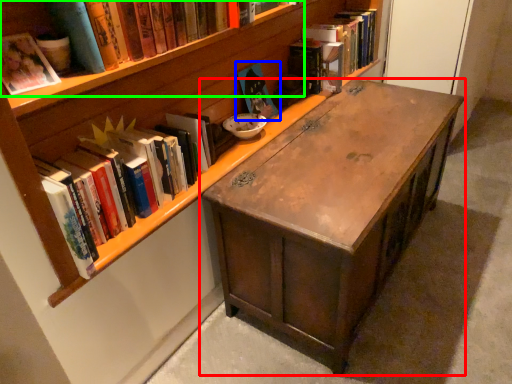
Question: Considering the real-world distances, which object is farthest from desk (highlighted by a red box)? book (highlighted by a blue box) or book (highlighted by a green box)?

Choices:
 (A) book
 (B) book

Answer: (B)